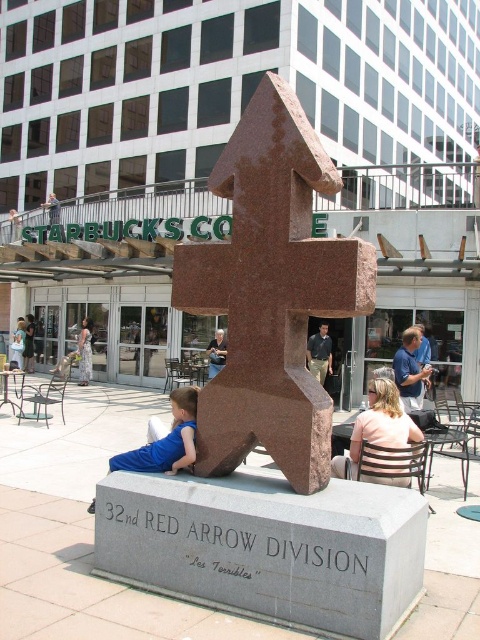
Is brown stone sculpture at center taller than blue denim jeans at center?

Indeed, brown stone sculpture at center has a greater height compared to blue denim jeans at center.

This screenshot has height=640, width=480. In order to click on brown stone sculpture at center in this screenshot , I will do `click(271, 292)`.

At what (x,y) coordinates should I click in order to perform the action: click on brown stone sculpture at center. Please return your answer as a coordinate pair (x, y). Image resolution: width=480 pixels, height=640 pixels. Looking at the image, I should click on (271, 292).

Describe the element at coordinates (271, 292) in the screenshot. The width and height of the screenshot is (480, 640). I see `brown stone sculpture at center` at that location.

Is brown stone sculpture at center positioned in front of blue fabric shirt at lower left?

Yes, brown stone sculpture at center is in front of blue fabric shirt at lower left.

Where is `brown stone sculpture at center`? The height and width of the screenshot is (640, 480). brown stone sculpture at center is located at coordinates (271, 292).

At what (x,y) coordinates should I click in order to perform the action: click on brown stone sculpture at center. Please return your answer as a coordinate pair (x, y). Looking at the image, I should click on (271, 292).

Does printed floral dress at center come in front of blue denim jeans at center?

No, it is not.

Is point (85, 320) less distant than point (218, 336)?

No, (85, 320) is behind (218, 336).

I want to click on printed floral dress at center, so click(84, 353).

Locate an element on the screen. This screenshot has width=480, height=640. printed floral dress at center is located at coordinates (84, 353).